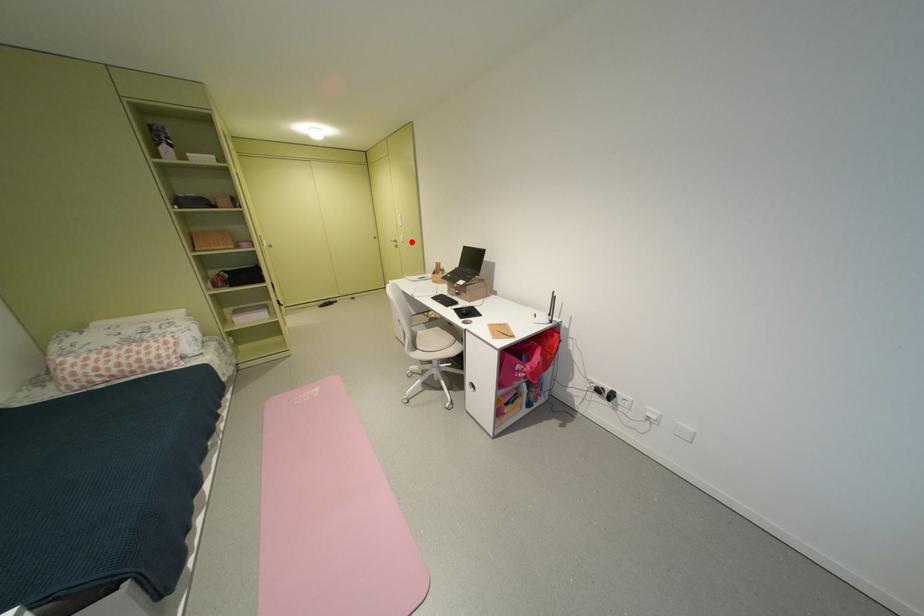
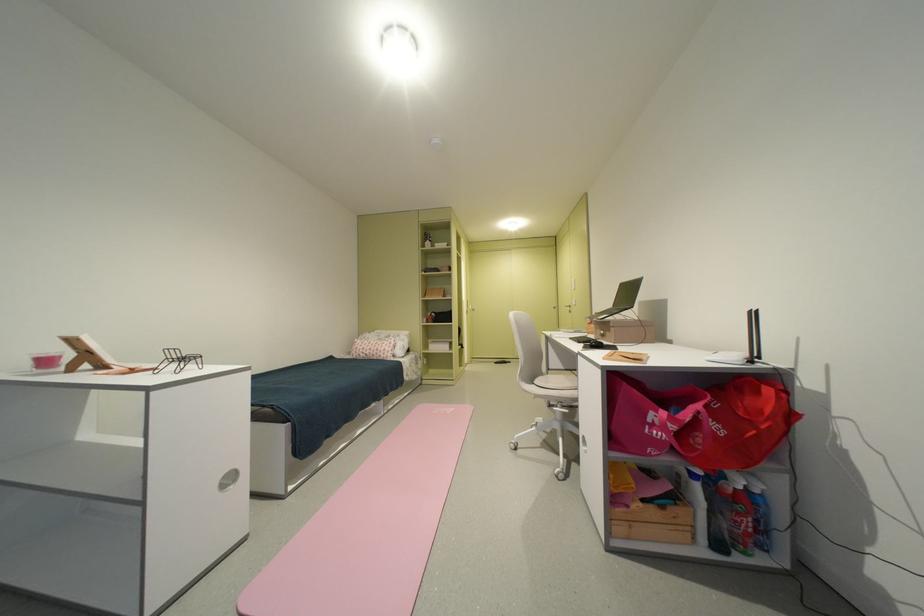
Question: I am providing you with two images of the same scene from different viewpoints. Image1 has a red point marked. In image2, the corresponding 3D location appears at what relative position? Reply with the corresponding letter.

Choices:
 (A) Closer
 (B) Farther

Answer: (B)